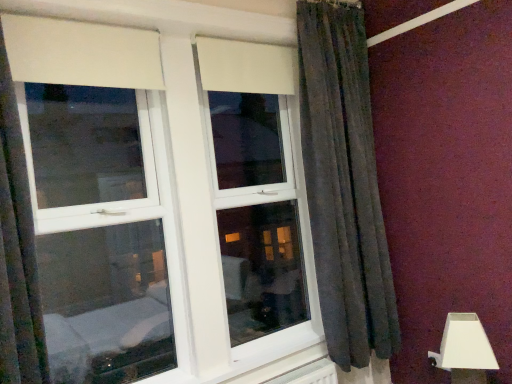
Question: From the image's perspective, is white plastic table lamp at lower right under white plastic window at upper center?

Choices:
 (A) yes
 (B) no

Answer: (A)

Question: Does white plastic table lamp at lower right turn towards white plastic window at upper center?

Choices:
 (A) yes
 (B) no

Answer: (B)

Question: Does white plastic table lamp at lower right have a lesser height compared to white plastic window at upper center?

Choices:
 (A) no
 (B) yes

Answer: (B)

Question: Are white plastic table lamp at lower right and white plastic window at upper center far apart?

Choices:
 (A) no
 (B) yes

Answer: (B)

Question: Is white plastic window at upper center completely or partially inside white plastic table lamp at lower right?

Choices:
 (A) yes
 (B) no

Answer: (B)

Question: From the image's perspective, is white plastic table lamp at lower right over white plastic window at upper center?

Choices:
 (A) no
 (B) yes

Answer: (A)

Question: From the image's perspective, is white plastic window at upper center under white plastic table lamp at lower right?

Choices:
 (A) yes
 (B) no

Answer: (B)

Question: Considering the relative positions of white plastic window at upper center and white plastic table lamp at lower right in the image provided, is white plastic window at upper center to the right of white plastic table lamp at lower right from the viewer's perspective?

Choices:
 (A) no
 (B) yes

Answer: (A)

Question: Is white plastic table lamp at lower right at the back of white plastic window at upper center?

Choices:
 (A) no
 (B) yes

Answer: (A)

Question: From a real-world perspective, is white plastic window at upper center located beneath white plastic table lamp at lower right?

Choices:
 (A) no
 (B) yes

Answer: (A)

Question: Does white plastic window at upper center have a greater width compared to white plastic table lamp at lower right?

Choices:
 (A) yes
 (B) no

Answer: (B)

Question: Considering the relative positions of white plastic window at upper center and white plastic table lamp at lower right in the image provided, is white plastic window at upper center in front of white plastic table lamp at lower right?

Choices:
 (A) yes
 (B) no

Answer: (A)

Question: Considering the positions of white plastic table lamp at lower right and white plastic window at upper center in the image, is white plastic table lamp at lower right taller or shorter than white plastic window at upper center?

Choices:
 (A) tall
 (B) short

Answer: (B)